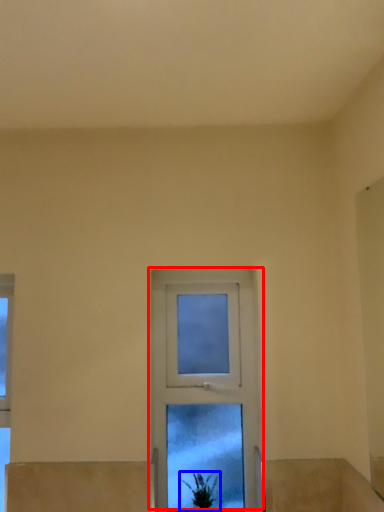
Question: Among these objects, which one is farthest to the camera, window (highlighted by a red box) or houseplant (highlighted by a blue box)?

Choices:
 (A) window
 (B) houseplant

Answer: (A)